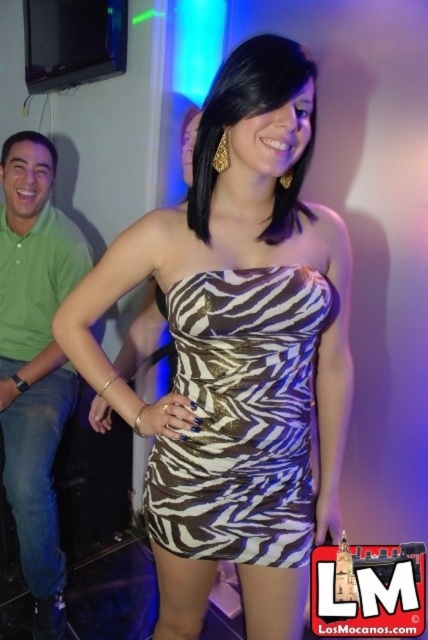
You are at a party and want to take a photo of both the zebra print dress at center and the green cotton shirt at left. Based on their positions, which one should you focus on first to ensure both are in the frame?

The zebra print dress at center is to the right of the green cotton shirt at left. To capture both in the frame, focus on the green cotton shirt at left first, then adjust to include the zebra print dress at center to the right.

You are at a party and need to decide which outfit is more suitable for a dance floor. The zebra print strapless dress at center is designed for movement, while the green cotton shirt at left is more casual. Based on their sizes, which one might be easier to move in?

The zebra print strapless dress at center is smaller than the green cotton shirt at left, so it might be easier to move in on the dance floor due to its more fitted and compact design.